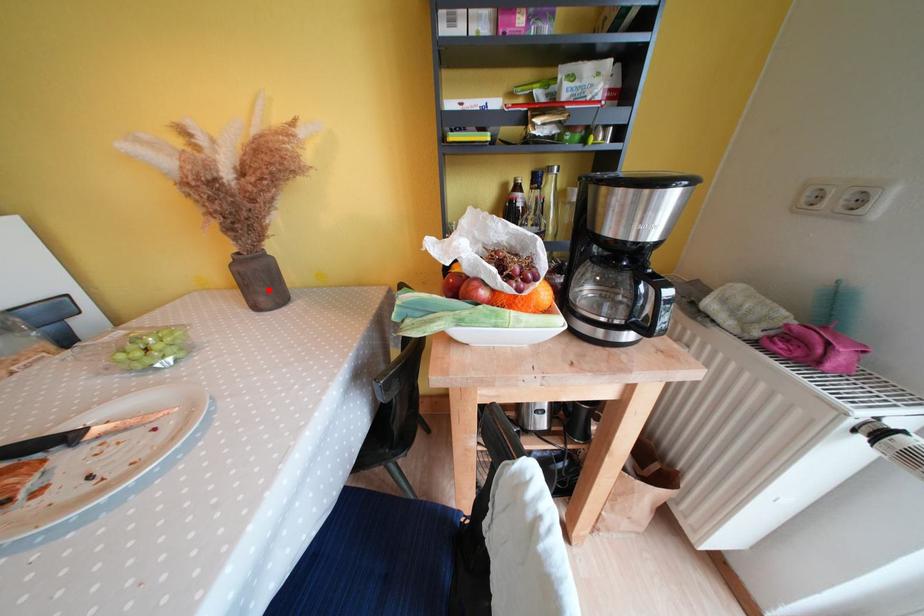
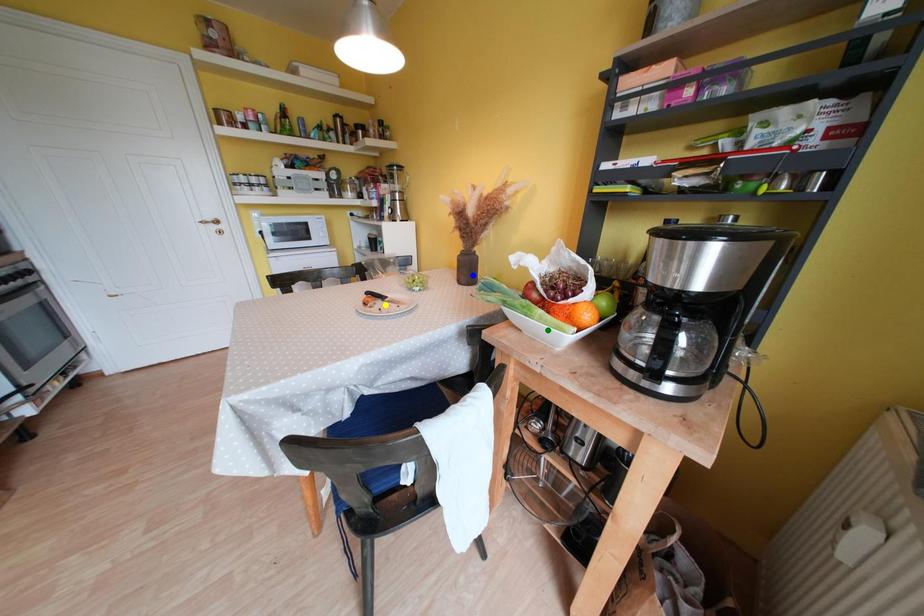
Question: I am providing you with two images of the same scene from different viewpoints. A red point is marked on the first image. You are given multiple points on the second image. Can you choose the point in image 2 that corresponds to the point in image 1?

Choices:
 (A) yellow point
 (B) blue point
 (C) green point

Answer: (B)